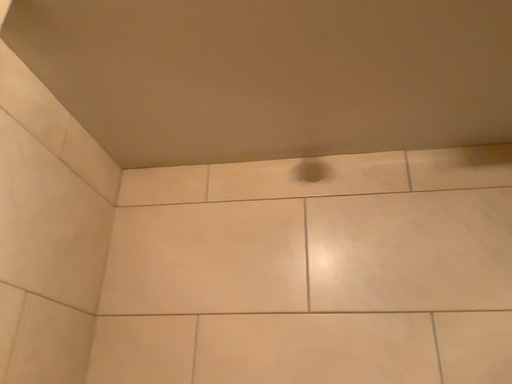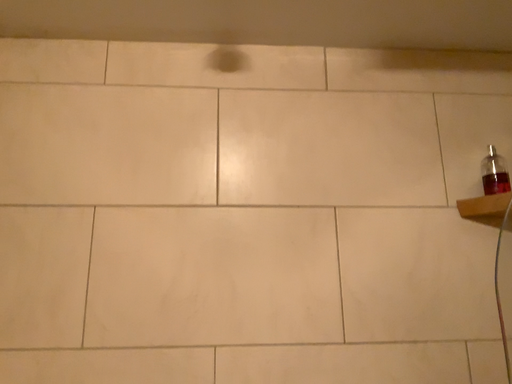
Question: How did the camera likely rotate when shooting the video?

Choices:
 (A) rotated upward
 (B) rotated downward

Answer: (B)